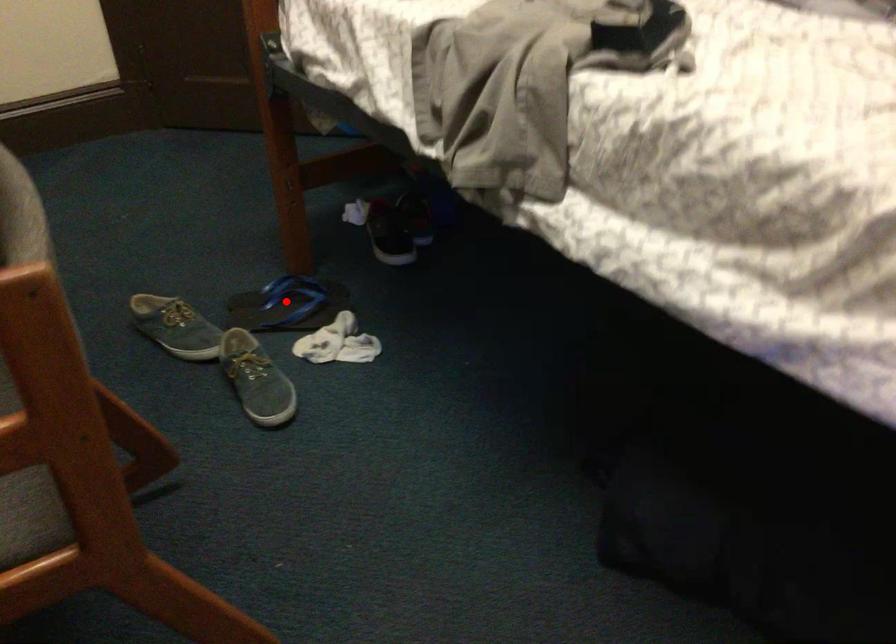
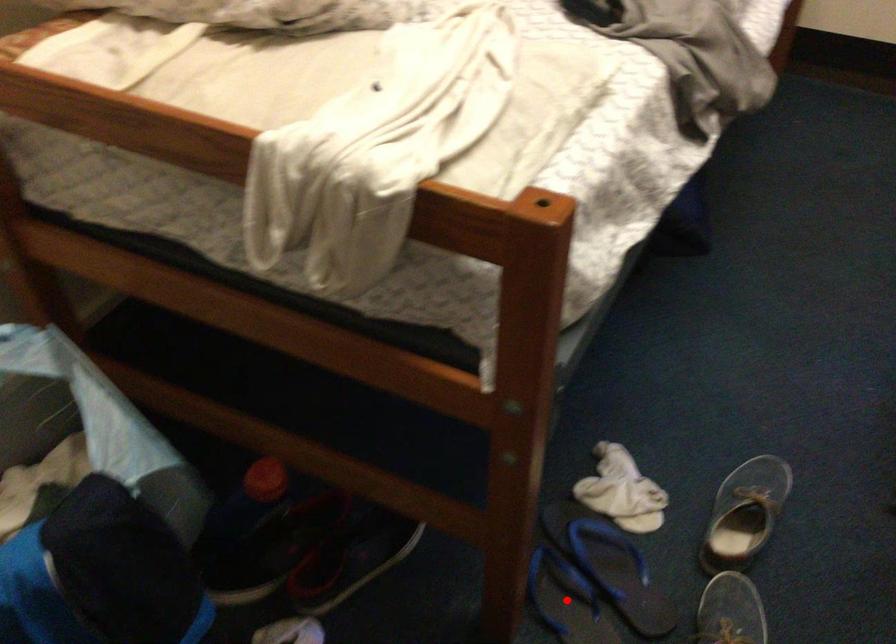
I am providing you with two images of the same scene from different viewpoints. A red point is marked on the first image and another point is marked on the second image. Do the highlighted points in image1 and image2 indicate the same real-world spot?

Yes